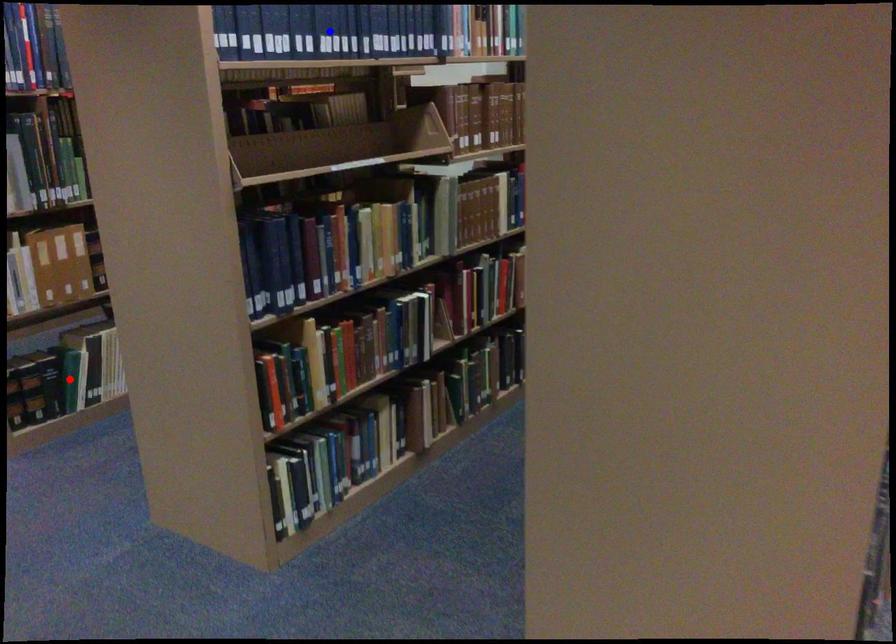
Question: Two points are marked on the image. Which point is closer to the camera?

Choices:
 (A) Blue point is closer.
 (B) Red point is closer.

Answer: (A)